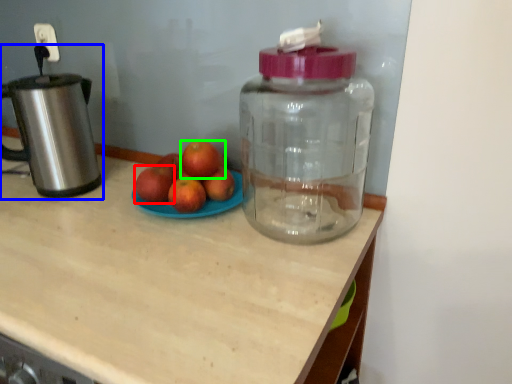
Question: Based on their relative distances, which object is nearer to apple (highlighted by a red box)? Choose from kitchen appliance (highlighted by a blue box) and grapefruit (highlighted by a green box).

Choices:
 (A) kitchen appliance
 (B) grapefruit

Answer: (B)